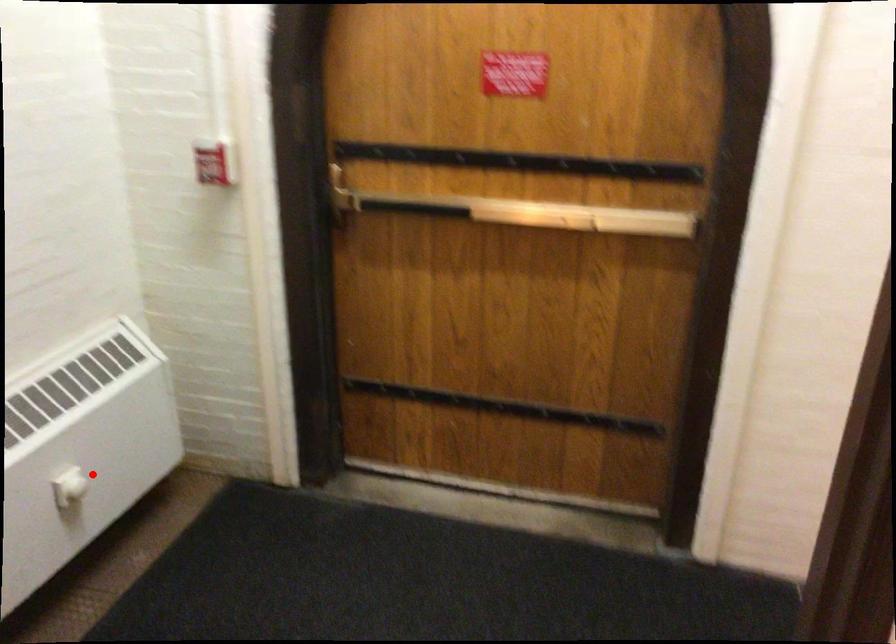
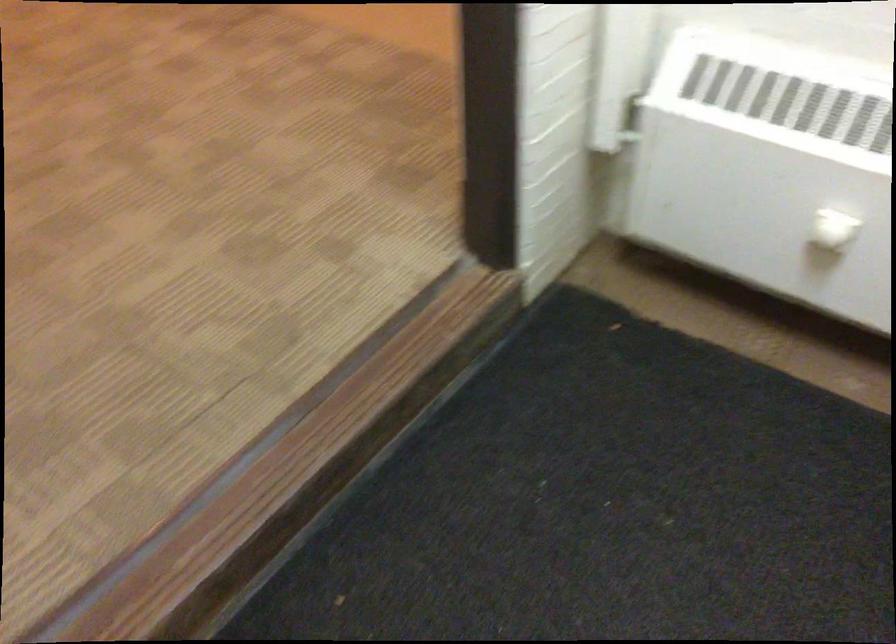
The point at the highlighted location is marked in the first image. Where is the corresponding point in the second image?

(831, 236)